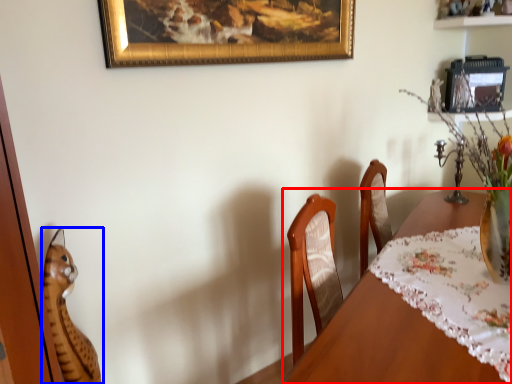
Question: Which of the following is the farthest to the observer, table (highlighted by a red box) or cat (highlighted by a blue box)?

Choices:
 (A) table
 (B) cat

Answer: (B)